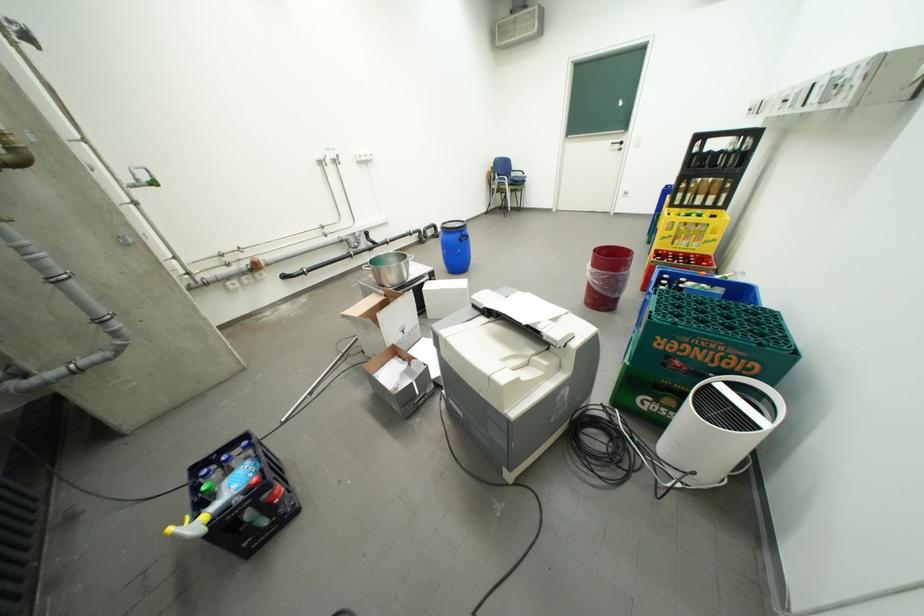
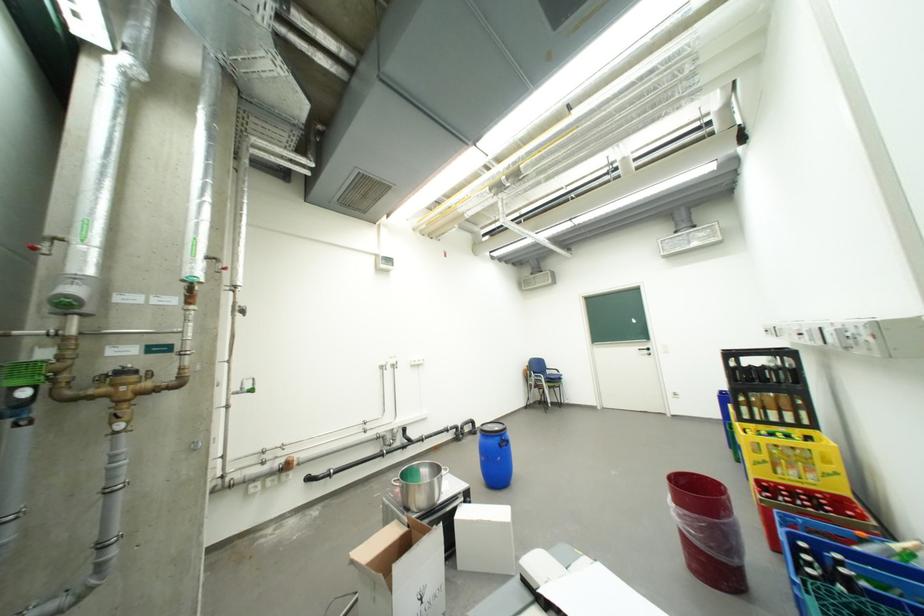
In the second image, find the point that corresponds to [468,233] in the first image.

(507, 438)